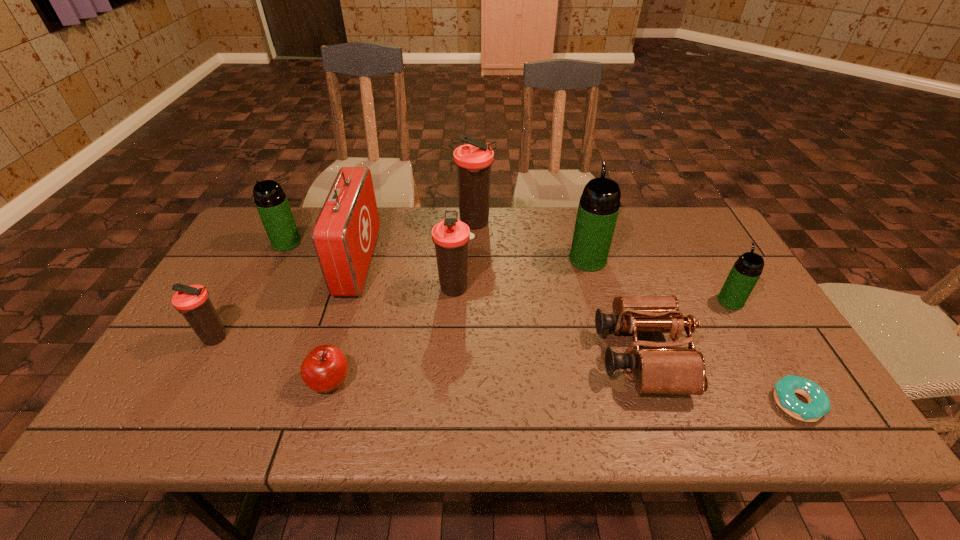
Where is `vacant space at the left edge`? This screenshot has width=960, height=540. vacant space at the left edge is located at coordinates (260, 265).

I want to click on vacant space at the far left corner, so click(298, 209).

The width and height of the screenshot is (960, 540). In order to click on vacant area at the near left corner of the desktop in this screenshot , I will do `click(194, 413)`.

Where is `free space at the near right corner of the desktop`? free space at the near right corner of the desktop is located at coordinates (790, 421).

This screenshot has height=540, width=960. Find the location of `vacant space in between the nearest thermos bottle and the biggest green thermos bottle`. vacant space in between the nearest thermos bottle and the biggest green thermos bottle is located at coordinates (401, 299).

Locate an element on the screen. free area in between the shortest object and the leftmost green thermos bottle is located at coordinates pyautogui.click(x=541, y=322).

This screenshot has width=960, height=540. Find the location of `free space between the second smallest green thermos bottle and the doughnut`. free space between the second smallest green thermos bottle and the doughnut is located at coordinates (541, 322).

At what (x,y) coordinates should I click in order to perform the action: click on free space between the first-aid kit and the farthest brown thermos bottle. Please return your answer as a coordinate pair (x, y). Image resolution: width=960 pixels, height=540 pixels. Looking at the image, I should click on (417, 242).

This screenshot has height=540, width=960. What are the coordinates of `free space between the binoculars and the smallest brown thermos bottle` in the screenshot? It's located at (428, 347).

The height and width of the screenshot is (540, 960). Find the location of `free area in between the apple and the rightmost thermos bottle`. free area in between the apple and the rightmost thermos bottle is located at coordinates (530, 341).